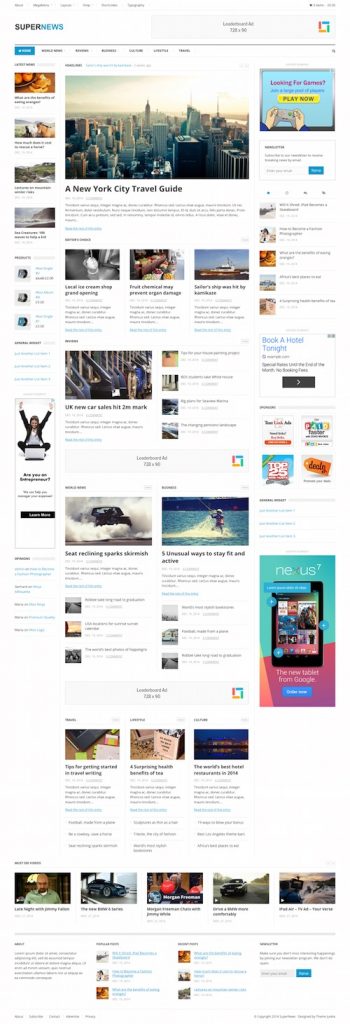
Where is `laptop`? laptop is located at coordinates (35, 453).